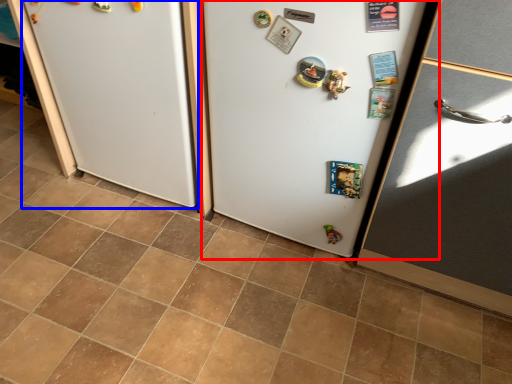
Question: Which of the following is the farthest to the observer, fridge (highlighted by a red box) or fridge (highlighted by a blue box)?

Choices:
 (A) fridge
 (B) fridge

Answer: (B)